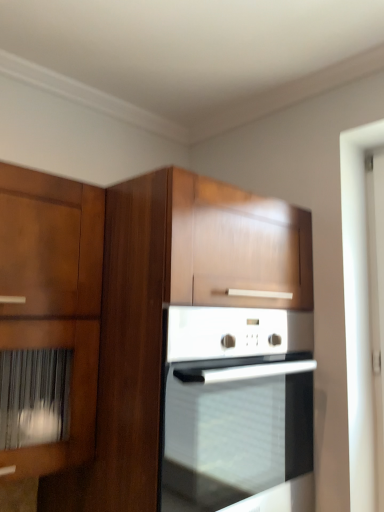
Question: Considering the positions of white glossy oven at center and white glossy screen door at right in the image, is white glossy oven at center wider or thinner than white glossy screen door at right?

Choices:
 (A) wide
 (B) thin

Answer: (A)

Question: Is white glossy oven at center in front of or behind white glossy screen door at right in the image?

Choices:
 (A) behind
 (B) front

Answer: (B)

Question: Based on their relative distances, which object is farther from the wooden cabinet at center?

Choices:
 (A) white glossy screen door at right
 (B) white glossy oven at center

Answer: (A)

Question: Estimate the real-world distances between objects in this image. Which object is closer to the white glossy oven at center?

Choices:
 (A) wooden cabinet at center
 (B) white glossy screen door at right

Answer: (A)